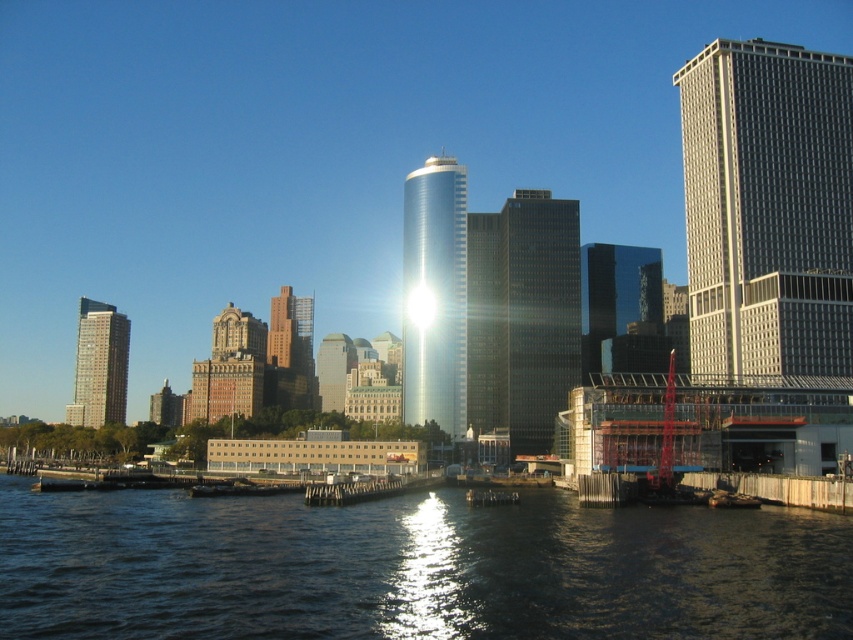
Does dark water at lower center appear on the right side of glossy metallic tower at center?

No, dark water at lower center is not to the right of glossy metallic tower at center.

Can you confirm if dark water at lower center is shorter than glossy metallic tower at center?

Indeed, dark water at lower center has a lesser height compared to glossy metallic tower at center.

You are a GUI agent. You are given a task and a screenshot of the screen. Output one action in this format:
    pyautogui.click(x=<x>, y=<y>)
    Task: Click on the dark water at lower center
    The height and width of the screenshot is (640, 853).
    Given the screenshot: What is the action you would take?
    pyautogui.click(x=413, y=566)

What are the coordinates of `dark water at lower center` in the screenshot? It's located at (413, 566).

Is dark water at lower center positioned in front of gray glass skyscraper at right?

Yes, dark water at lower center is closer to the viewer.

Is dark water at lower center taller than gray glass skyscraper at right?

No.

Identify the location of dark water at lower center. (413, 566).

Is shiny glass skyscraper at center smaller than matte glass skyscraper at left?

Indeed, shiny glass skyscraper at center has a smaller size compared to matte glass skyscraper at left.

Can you confirm if shiny glass skyscraper at center is taller than matte glass skyscraper at left?

Incorrect, shiny glass skyscraper at center's height is not larger of matte glass skyscraper at left's.

This screenshot has height=640, width=853. What are the coordinates of `shiny glass skyscraper at center` in the screenshot? It's located at (618, 296).